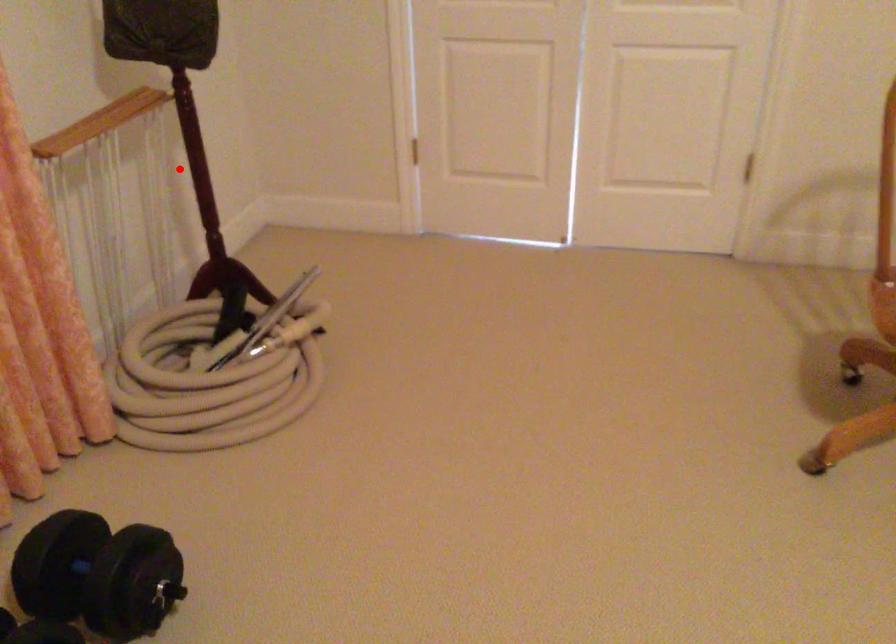
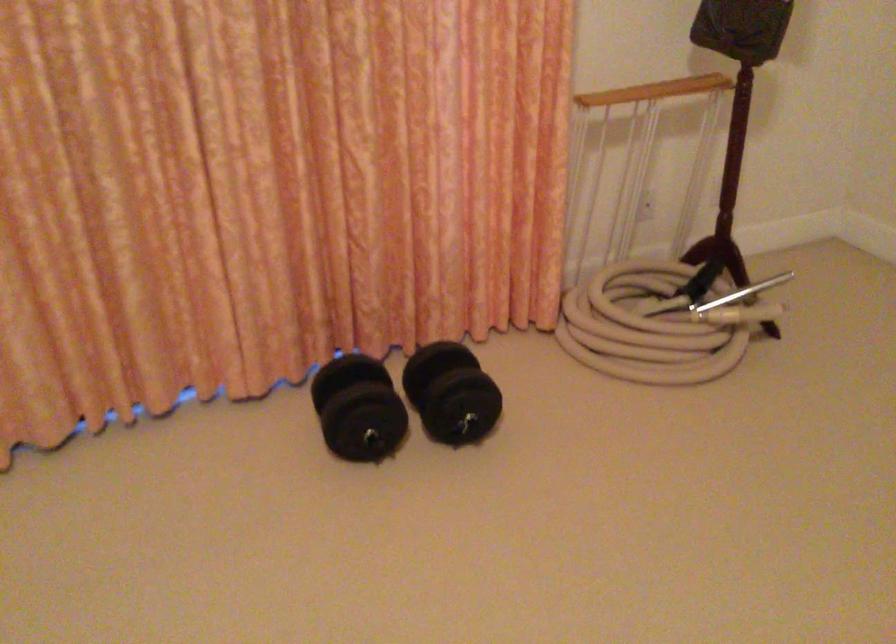
Find the pixel in the second image that matches the highlighted location in the first image.

(719, 137)